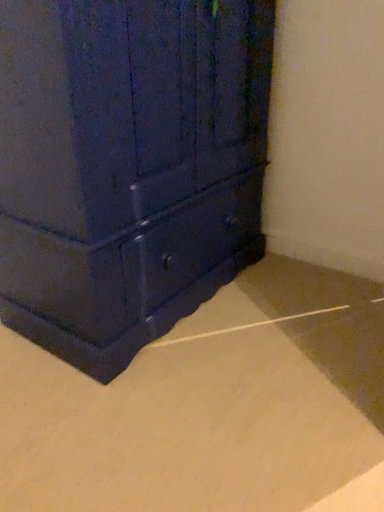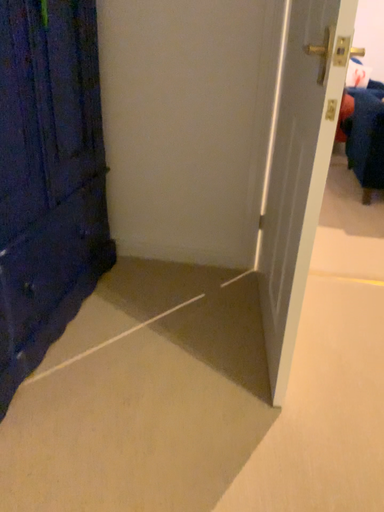
Question: Which way did the camera rotate in the video?

Choices:
 (A) rotated left
 (B) rotated right

Answer: (B)